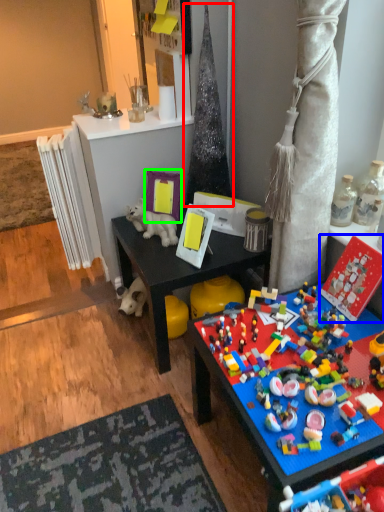
Question: Which is nearer to the christmas tree (highlighted by a red box)? toy (highlighted by a blue box) or picture frame (highlighted by a green box).

Choices:
 (A) toy
 (B) picture frame

Answer: (B)